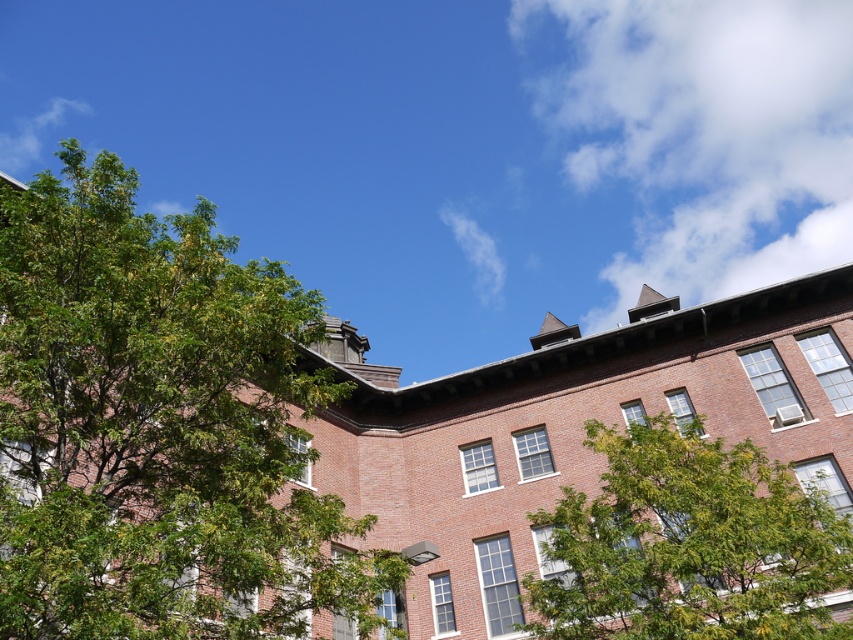
Is green leafy tree at upper left further to camera compared to green leafy tree at lower right?

That is False.

Consider the image. Which is above, green leafy tree at upper left or green leafy tree at lower right?

green leafy tree at upper left is above.

Between point (65, 353) and point (738, 611), which one is positioned behind?

The point (738, 611) is more distant.

The width and height of the screenshot is (853, 640). In order to click on green leafy tree at upper left in this screenshot , I will do `click(158, 428)`.